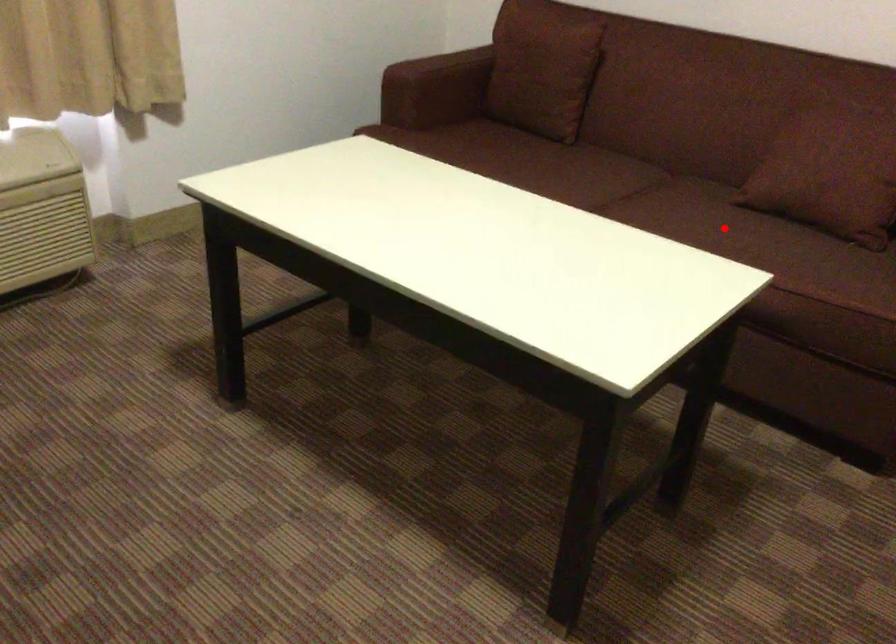
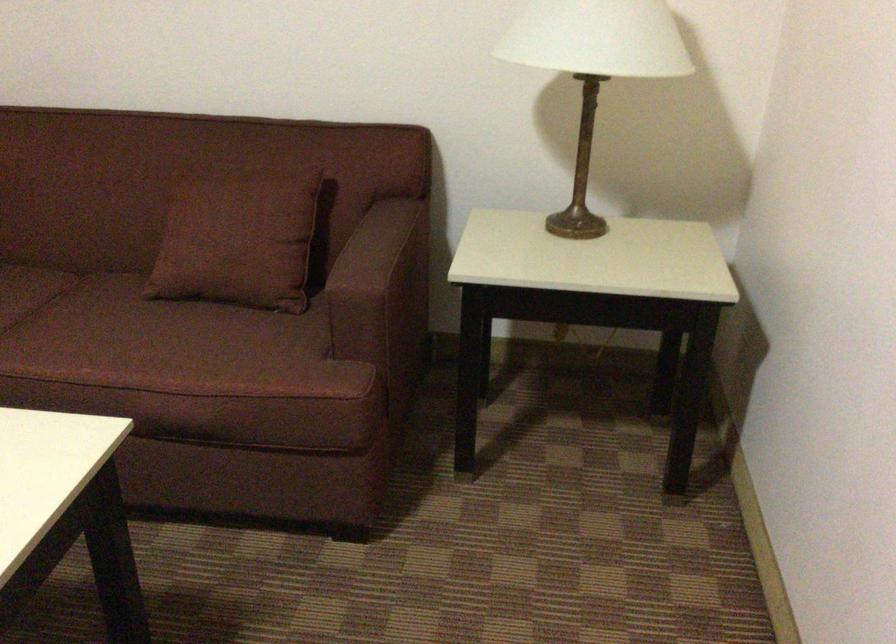
Question: A red point is marked in image1. In image2, is the corresponding 3D point closer to the camera or farther? Reply with the corresponding letter.

Choices:
 (A) The corresponding 3D point is closer.
 (B) The corresponding 3D point is farther.

Answer: (A)